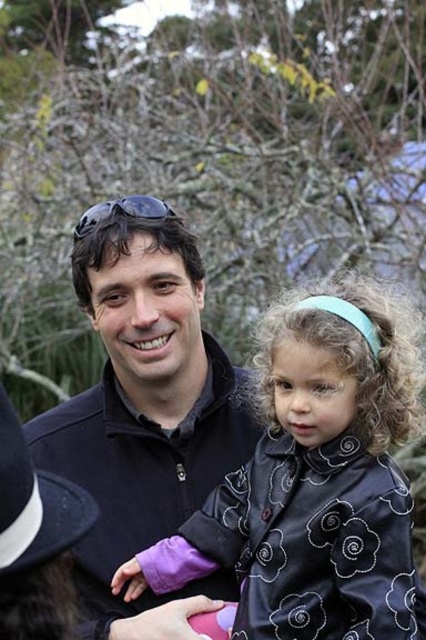
Is black satin coat at center positioned behind matte black jacket at center?

No, it is in front of matte black jacket at center.

Consider the image. Does black satin coat at center appear on the right side of matte black jacket at center?

Indeed, black satin coat at center is positioned on the right side of matte black jacket at center.

Is point (284, 433) closer to camera compared to point (114, 556)?

Yes, point (284, 433) is closer to viewer.

The image size is (426, 640). I want to click on black satin coat at center, so click(316, 477).